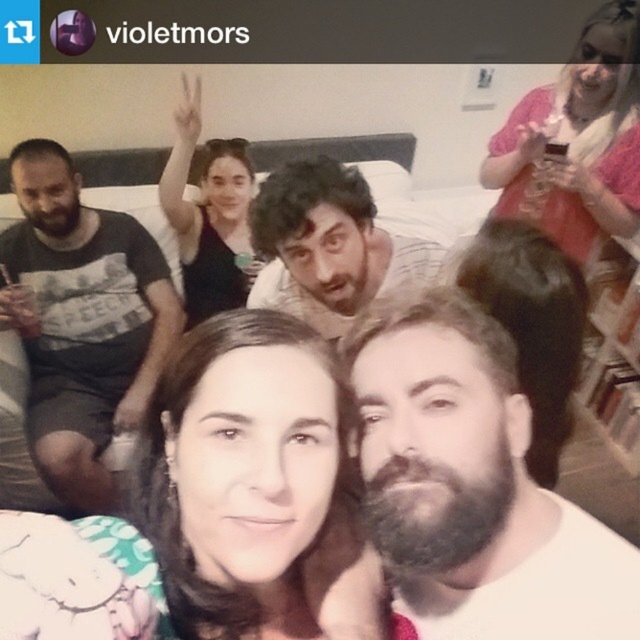
Question: Does matte black t-shirt at left appear on the right side of pink sheer blouse at upper right?

Choices:
 (A) no
 (B) yes

Answer: (A)

Question: Which point is closer to the camera?

Choices:
 (A) 304,179
 (B) 138,324
 (C) 492,570

Answer: (C)

Question: Which is nearer to the pink sheer blouse at upper right?

Choices:
 (A) matte black t-shirt at left
 (B) bearded white shirt at center
 (C) dark brown hair at center

Answer: (C)

Question: Which object is positioned closest to the dark brown hair at center?

Choices:
 (A) bearded white shirt at center
 (B) smooth brown hair at center
 (C) matte black t-shirt at left
 (D) pink sheer blouse at upper right

Answer: (B)

Question: Can you confirm if matte black t-shirt at left is smaller than pink sheer blouse at upper right?

Choices:
 (A) yes
 (B) no

Answer: (B)

Question: Does dark brown hair at center have a greater width compared to matte black shirt at center?

Choices:
 (A) no
 (B) yes

Answer: (B)